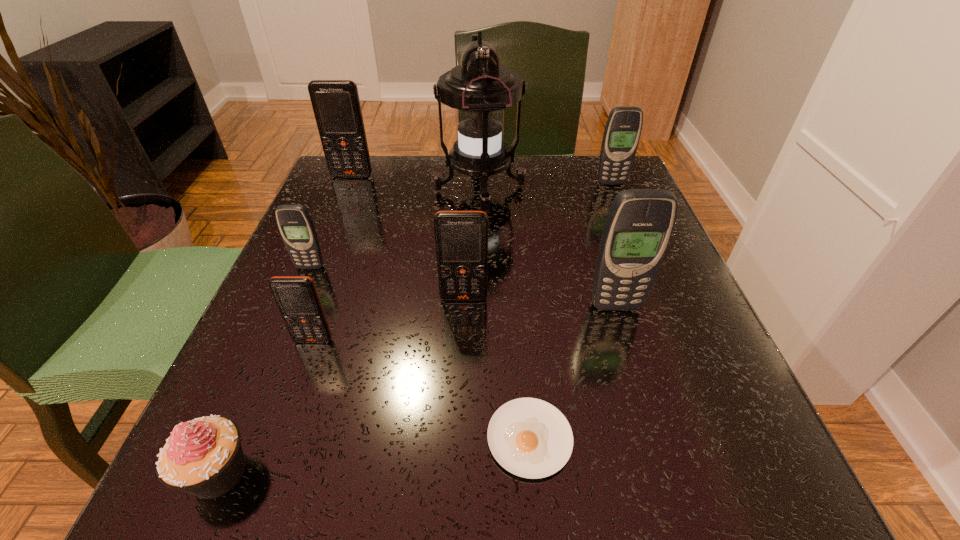
I want to click on the smallest orange cellular telephone, so click(x=297, y=298).

Find the location of a particular element. the fourth nearest cellular telephone is located at coordinates (295, 224).

The width and height of the screenshot is (960, 540). In order to click on the fourth farthest object in this screenshot , I will do `click(295, 224)`.

Locate an element on the screen. the eighth tallest object is located at coordinates (204, 457).

Locate an element on the screen. The image size is (960, 540). pink cupcake is located at coordinates (204, 457).

The image size is (960, 540). I want to click on the shortest object, so click(x=530, y=438).

Locate an element on the screen. Image resolution: width=960 pixels, height=540 pixels. egg yolk is located at coordinates (530, 438).

At what (x,y) coordinates should I click in order to perform the action: click on vacant space located on the right of the black lantern. Please return your answer as a coordinate pair (x, y). This screenshot has width=960, height=540. Looking at the image, I should click on (629, 189).

I want to click on vacant space situated 0.240m on the screen of the farthest cellular telephone, so click(325, 241).

Identify the location of vacant area situated 0.160m on the screen of the biggest gray cellular telephone. (642, 395).